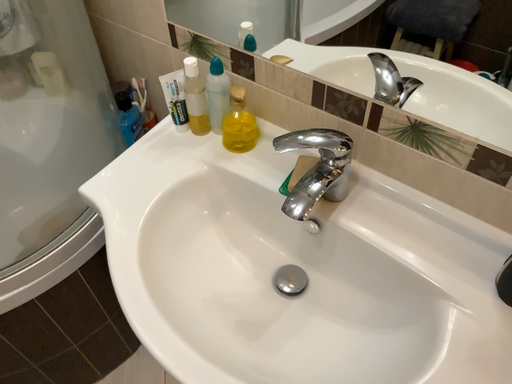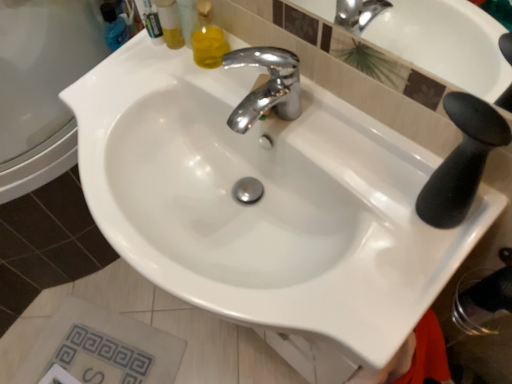
Question: Which way did the camera rotate in the video?

Choices:
 (A) rotated upward
 (B) rotated downward

Answer: (B)